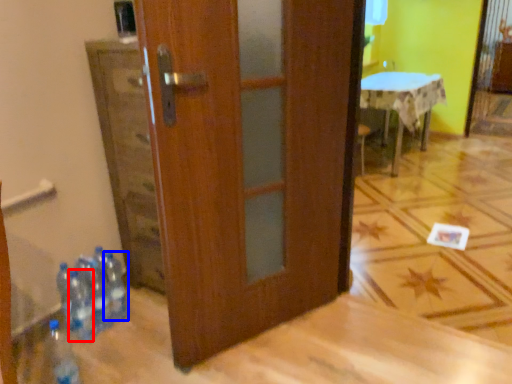
Question: Which object is closer to the camera taking this photo, bottle (highlighted by a red box) or bottle (highlighted by a blue box)?

Choices:
 (A) bottle
 (B) bottle

Answer: (A)